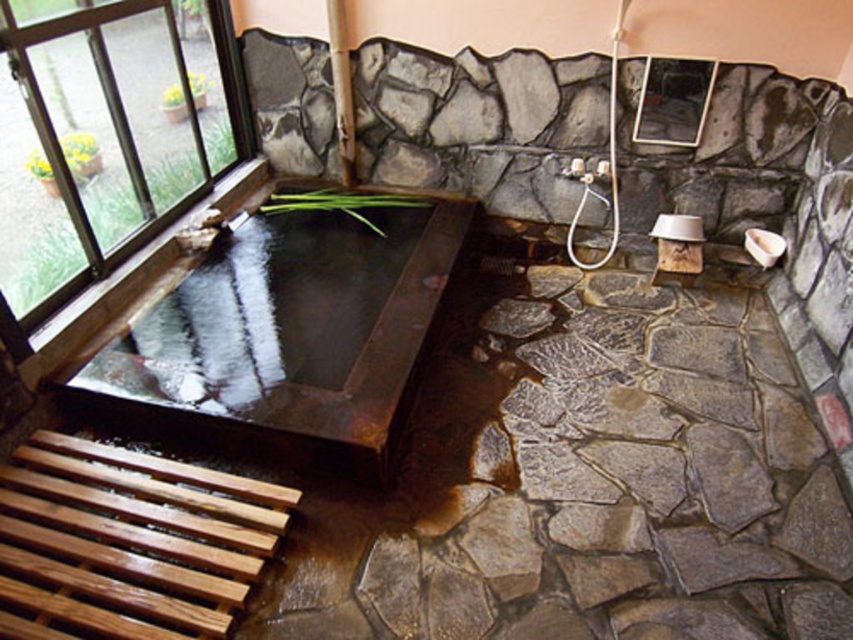
You are standing at the entrance of the onsen area and want to locate the rusty metal tub at center. Based on the coordinates provided, in which direction relative to the entrance should you look to find it?

The rusty metal tub at center is located at coordinates point (287, 337), which would be slightly to the right and forward from the entrance.

You are a guest at a Japanese ryokan and want to know if the rusty metal tub at center can fit through the clear glass window at upper left if needed. Based on their sizes, can the tub pass through the window?

The rusty metal tub at center is wider than the clear glass window at upper left, so it cannot pass through the window.